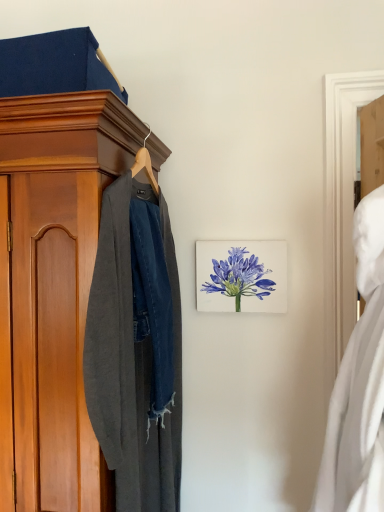
Question: From the image's perspective, relative to dark gray wool coat at left, is watercolor blue flower at center above or below?

Choices:
 (A) below
 (B) above

Answer: (B)

Question: Is watercolor blue flower at center inside the boundaries of dark gray wool coat at left, or outside?

Choices:
 (A) outside
 (B) inside

Answer: (A)

Question: Which of these objects is positioned farthest from the watercolor blue flower at center?

Choices:
 (A) white matte dress at right
 (B) dark gray wool coat at left

Answer: (A)

Question: Which object is positioned closest to the white matte dress at right?

Choices:
 (A) dark gray wool coat at left
 (B) watercolor blue flower at center

Answer: (A)